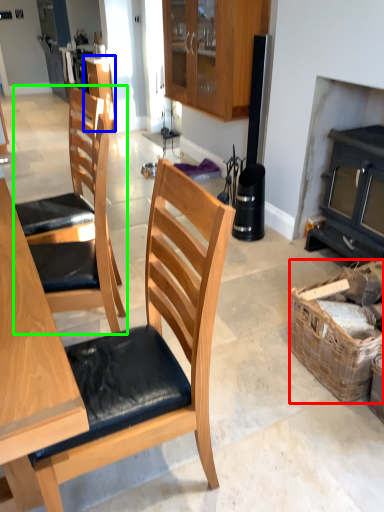
Question: Which is nearer to the picnic basket (highlighted by a red box)? cabinetry (highlighted by a blue box) or chair (highlighted by a green box).

Choices:
 (A) cabinetry
 (B) chair

Answer: (B)